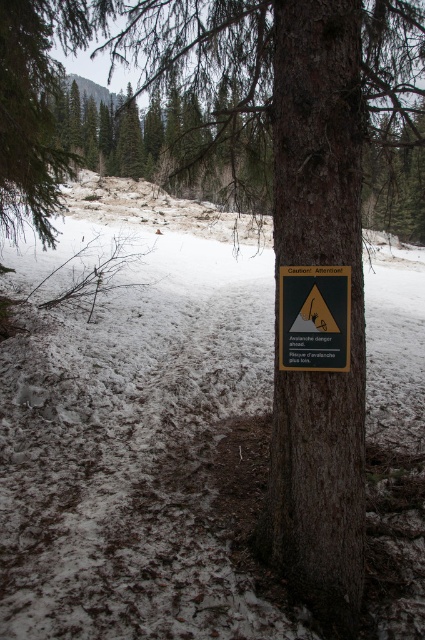
Is white powdery snow at center wider than green plastic sign at center?

Indeed, white powdery snow at center has a greater width compared to green plastic sign at center.

Measure the distance between white powdery snow at center and camera.

white powdery snow at center and camera are 3.04 meters apart from each other.

What are the coordinates of `white powdery snow at center` in the screenshot? It's located at (135, 424).